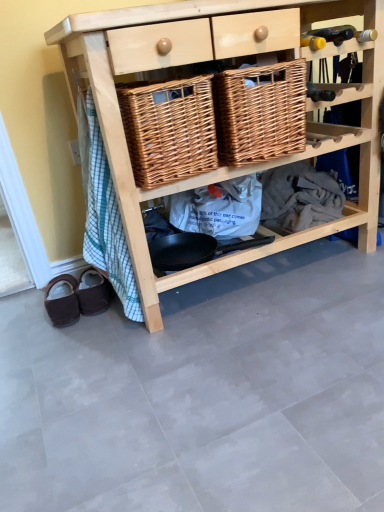
Question: Is brown suede mule at lower left, which is counted as the second footwear, starting from the left, positioned beyond the bounds of woven brown basket at center, the first basket viewed from the right?

Choices:
 (A) yes
 (B) no

Answer: (A)

Question: Can you confirm if brown suede mule at lower left, which is counted as the second footwear, starting from the left, is positioned to the right of woven brown basket at center, the first basket viewed from the right?

Choices:
 (A) no
 (B) yes

Answer: (A)

Question: From a real-world perspective, is brown suede mule at lower left, which is counted as the first footwear, starting from the right, physically below woven brown basket at center, the first basket viewed from the right?

Choices:
 (A) no
 (B) yes

Answer: (B)

Question: Is brown suede mule at lower left, which is counted as the second footwear, starting from the left, facing away from woven brown basket at center, the first basket viewed from the right?

Choices:
 (A) yes
 (B) no

Answer: (B)

Question: Is brown suede mule at lower left, which is counted as the second footwear, starting from the left, at the left side of woven brown basket at center, acting as the second basket starting from the left?

Choices:
 (A) no
 (B) yes

Answer: (B)

Question: Does brown suede mule at lower left, which is counted as the first footwear, starting from the right, have a greater width compared to woven brown basket at center, the first basket viewed from the right?

Choices:
 (A) yes
 (B) no

Answer: (B)

Question: Is natural wood shelf at center surrounded by brown suede slippers at lower left, the second footwear from the right?

Choices:
 (A) yes
 (B) no

Answer: (B)

Question: From the image's perspective, is brown suede slippers at lower left, the second footwear from the right, above natural wood shelf at center?

Choices:
 (A) no
 (B) yes

Answer: (A)

Question: Can you confirm if brown suede slippers at lower left, which is the 1th footwear in left-to-right order, is positioned to the left of natural wood shelf at center?

Choices:
 (A) yes
 (B) no

Answer: (A)

Question: Is brown suede slippers at lower left, the second footwear from the right, to the right of natural wood shelf at center from the viewer's perspective?

Choices:
 (A) no
 (B) yes

Answer: (A)

Question: Is brown suede slippers at lower left, which is the 1th footwear in left-to-right order, looking in the opposite direction of natural wood shelf at center?

Choices:
 (A) yes
 (B) no

Answer: (B)

Question: Is brown suede slippers at lower left, the second footwear from the right, smaller than natural wood shelf at center?

Choices:
 (A) yes
 (B) no

Answer: (A)

Question: Is brown suede mule at lower left, which is counted as the second footwear, starting from the left, bigger than brown suede slippers at lower left, the second footwear from the right?

Choices:
 (A) no
 (B) yes

Answer: (A)